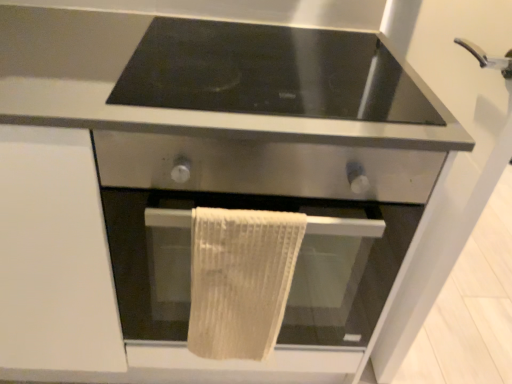
Describe the element at coordinates (240, 280) in the screenshot. I see `white textured towel at center` at that location.

Measure the distance between white textured towel at center and camera.

white textured towel at center and camera are 29.56 inches apart.

Locate an element on the screen. white textured towel at center is located at coordinates [x=240, y=280].

Find the location of a particular element. white textured towel at center is located at coordinates (240, 280).